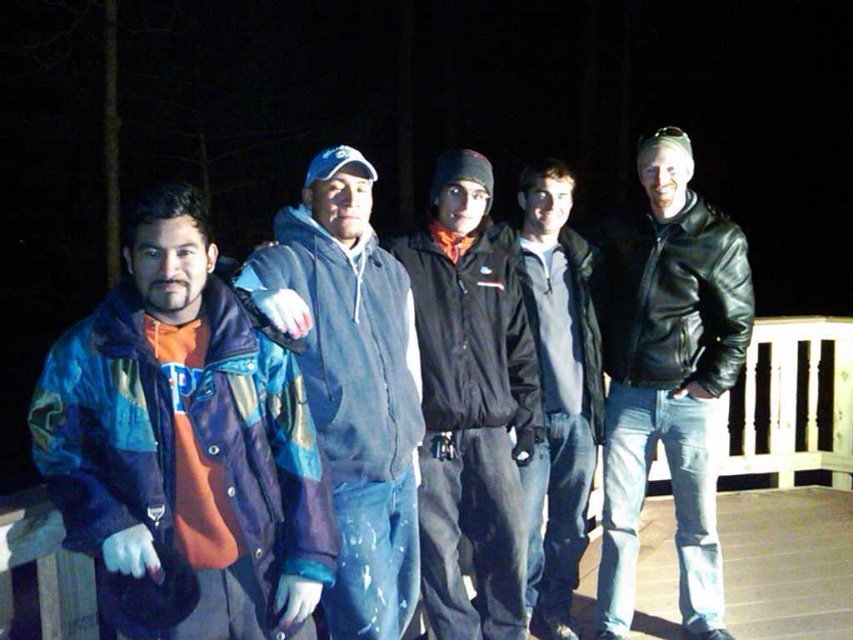
Question: Does multicolored fabric jacket at left have a lesser width compared to black matte jacket at center?

Choices:
 (A) yes
 (B) no

Answer: (B)

Question: Which object appears farthest from the camera in this image?

Choices:
 (A) black matte jacket at center
 (B) black leather jacket at right
 (C) dark gray fleece jacket at center
 (D) multicolored fabric jacket at left

Answer: (B)

Question: Which object appears closest to the camera in this image?

Choices:
 (A) black matte jacket at center
 (B) black leather jacket at right

Answer: (A)

Question: Observing the image, what is the correct spatial positioning of black leather jacket at right in reference to dark blue fleece jacket at center?

Choices:
 (A) above
 (B) below

Answer: (A)

Question: Estimate the real-world distances between objects in this image. Which object is closer to the multicolored fabric jacket at left?

Choices:
 (A) dark blue fleece jacket at center
 (B) dark gray fleece jacket at center

Answer: (A)

Question: Is wooden at center bigger than dark gray fleece jacket at center?

Choices:
 (A) yes
 (B) no

Answer: (B)